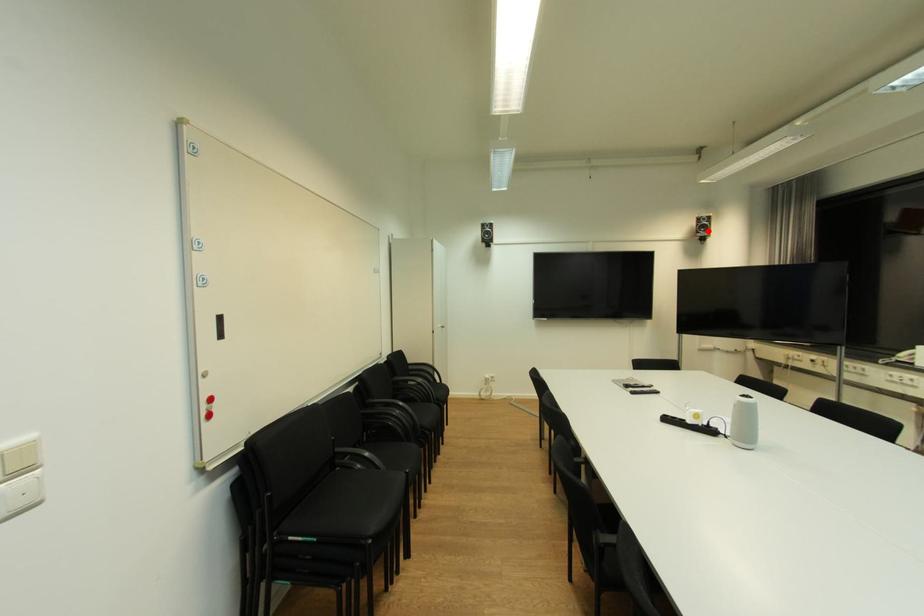
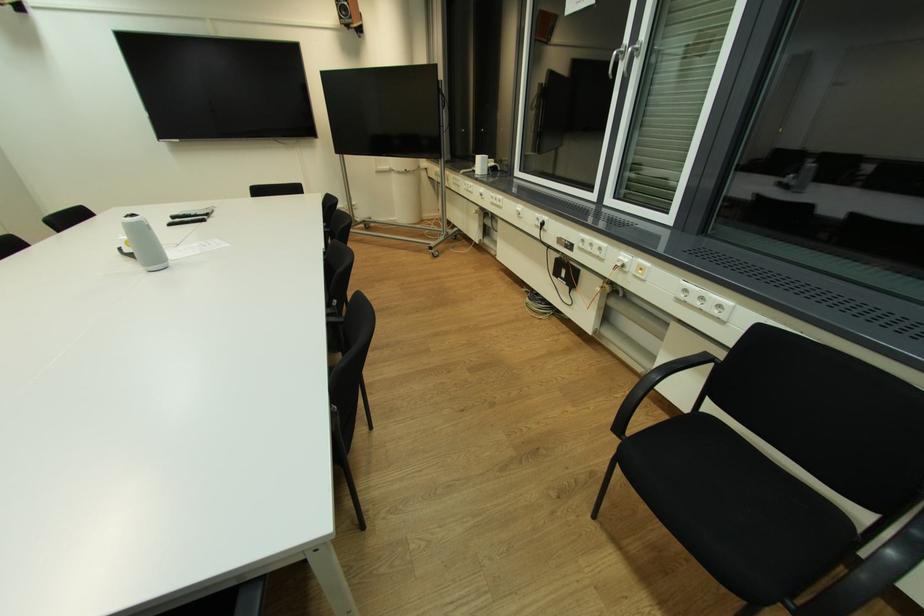
Where in the second image is the point corresponding to the highlighted location from the first image?

(349, 15)